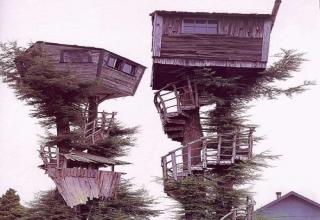
Where is `window`? window is located at coordinates pos(77,55), pos(199,24), pos(125,67).